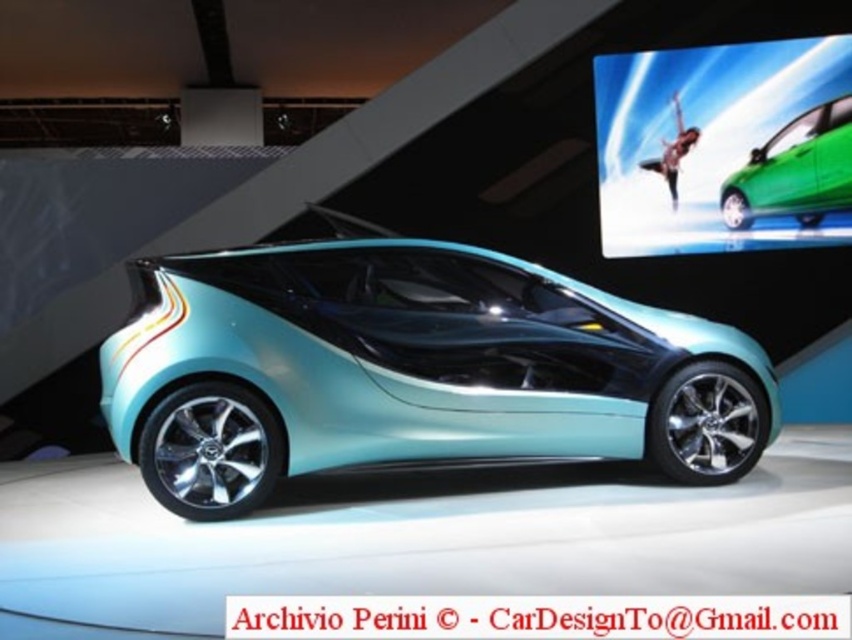
Looking at this image, between metallic teal car at center and green glossy car at center, which one is positioned lower?

metallic teal car at center is below.

Who is higher up, metallic teal car at center or green glossy car at center?

green glossy car at center

Who is more forward, (407,420) or (735,177)?

Positioned in front is point (407,420).

Where is `metallic teal car at center`? This screenshot has height=640, width=852. metallic teal car at center is located at coordinates (412, 371).